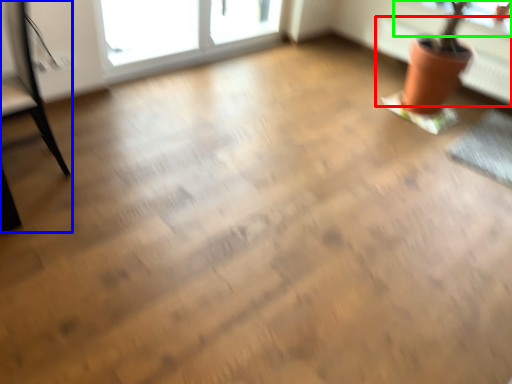
Question: Considering the real-world distances, which object is farthest from radiator (highlighted by a red box)? armchair (highlighted by a blue box) or window screen (highlighted by a green box)?

Choices:
 (A) armchair
 (B) window screen

Answer: (A)